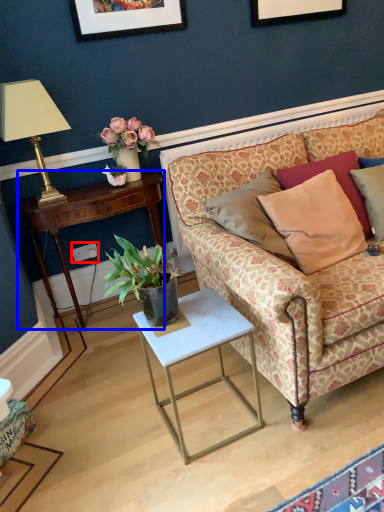
Question: Which point is closer to the camera, power outlet (highlighted by a red box) or desk (highlighted by a blue box)?

Choices:
 (A) power outlet
 (B) desk

Answer: (B)